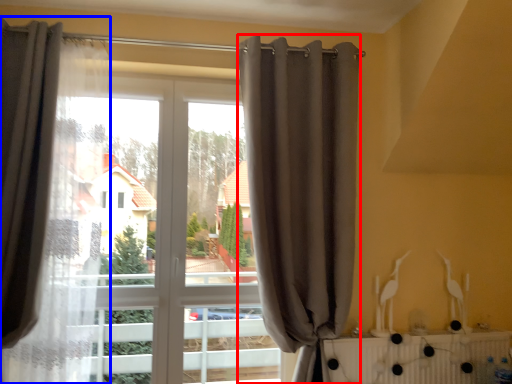
Question: Which object is closer to the camera taking this photo, curtain (highlighted by a red box) or curtain (highlighted by a blue box)?

Choices:
 (A) curtain
 (B) curtain

Answer: (B)